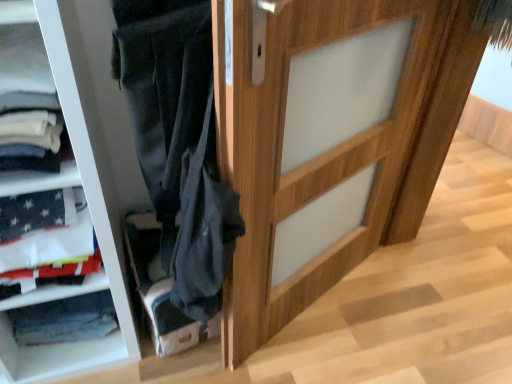
Question: From a real-world perspective, is wooden door at center physically above velvet dark blue pants at lower center?

Choices:
 (A) yes
 (B) no

Answer: (A)

Question: Is wooden door at center aimed at velvet dark blue pants at lower center?

Choices:
 (A) yes
 (B) no

Answer: (B)

Question: Is velvet dark blue pants at lower center at the back of wooden door at center?

Choices:
 (A) yes
 (B) no

Answer: (A)

Question: Considering the relative sizes of wooden door at center and velvet dark blue pants at lower center in the image provided, is wooden door at center taller than velvet dark blue pants at lower center?

Choices:
 (A) yes
 (B) no

Answer: (A)

Question: Is wooden door at center wider than velvet dark blue pants at lower center?

Choices:
 (A) no
 (B) yes

Answer: (A)

Question: Is wooden door at center positioned beyond the bounds of velvet dark blue pants at lower center?

Choices:
 (A) yes
 (B) no

Answer: (A)

Question: Is velvet dark blue pants at lower center to the left of wooden door at center from the viewer's perspective?

Choices:
 (A) no
 (B) yes

Answer: (B)

Question: From the image's perspective, is velvet dark blue pants at lower center under wooden door at center?

Choices:
 (A) no
 (B) yes

Answer: (B)

Question: Can you confirm if velvet dark blue pants at lower center is smaller than wooden door at center?

Choices:
 (A) yes
 (B) no

Answer: (A)

Question: Is velvet dark blue pants at lower center bigger than wooden door at center?

Choices:
 (A) yes
 (B) no

Answer: (B)

Question: Does velvet dark blue pants at lower center have a lesser height compared to wooden door at center?

Choices:
 (A) no
 (B) yes

Answer: (B)

Question: Would you say velvet dark blue pants at lower center is a long distance from wooden door at center?

Choices:
 (A) yes
 (B) no

Answer: (B)

Question: From a real-world perspective, is velvet dark blue pants at lower center above or below wooden door at center?

Choices:
 (A) above
 (B) below

Answer: (B)